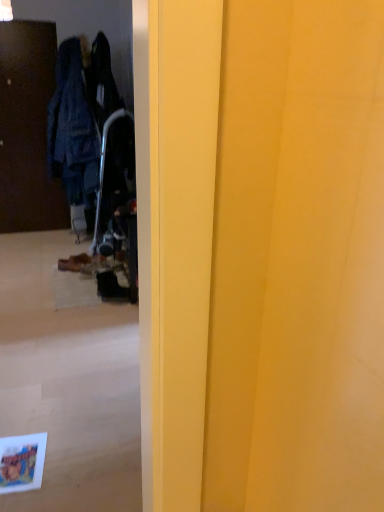
Question: Which is correct: dark wood door at left is inside brown suede shoe at lower left, or outside of it?

Choices:
 (A) inside
 (B) outside

Answer: (B)

Question: Considering the positions of dark wood door at left and brown suede shoe at lower left in the image, is dark wood door at left taller or shorter than brown suede shoe at lower left?

Choices:
 (A) short
 (B) tall

Answer: (B)

Question: From a real-world perspective, is dark wood door at left physically located above or below brown suede shoe at lower left?

Choices:
 (A) above
 (B) below

Answer: (A)

Question: From the image's perspective, is brown suede shoe at lower left positioned above or below dark wood door at left?

Choices:
 (A) above
 (B) below

Answer: (B)

Question: Is brown suede shoe at lower left in front of or behind dark wood door at left in the image?

Choices:
 (A) behind
 (B) front

Answer: (B)

Question: Looking at the image, does brown suede shoe at lower left seem bigger or smaller compared to dark wood door at left?

Choices:
 (A) big
 (B) small

Answer: (B)

Question: Based on their positions, is brown suede shoe at lower left located to the left or right of dark wood door at left?

Choices:
 (A) left
 (B) right

Answer: (B)